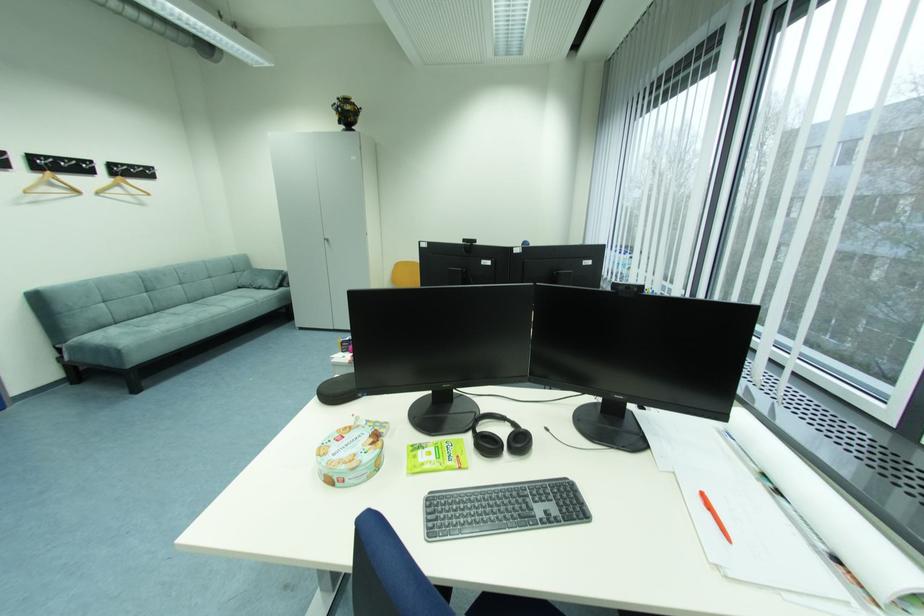
You are a GUI agent. You are given a task and a screenshot of the screen. Output one action in this format:
    pyautogui.click(x=<x>, y=<y>)
    Task: Click on the black coat hook
    
    Given the screenshot: What is the action you would take?
    [x=500, y=437]